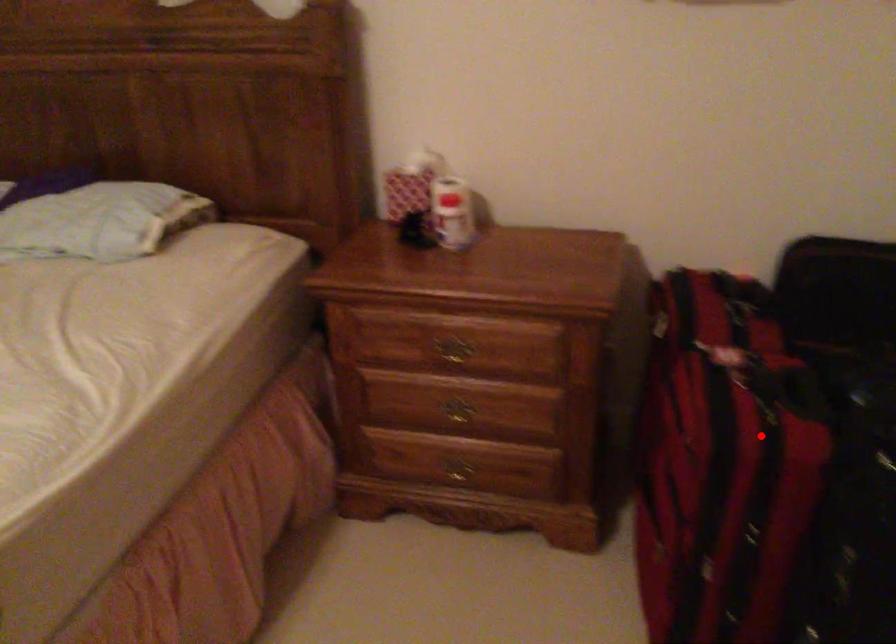
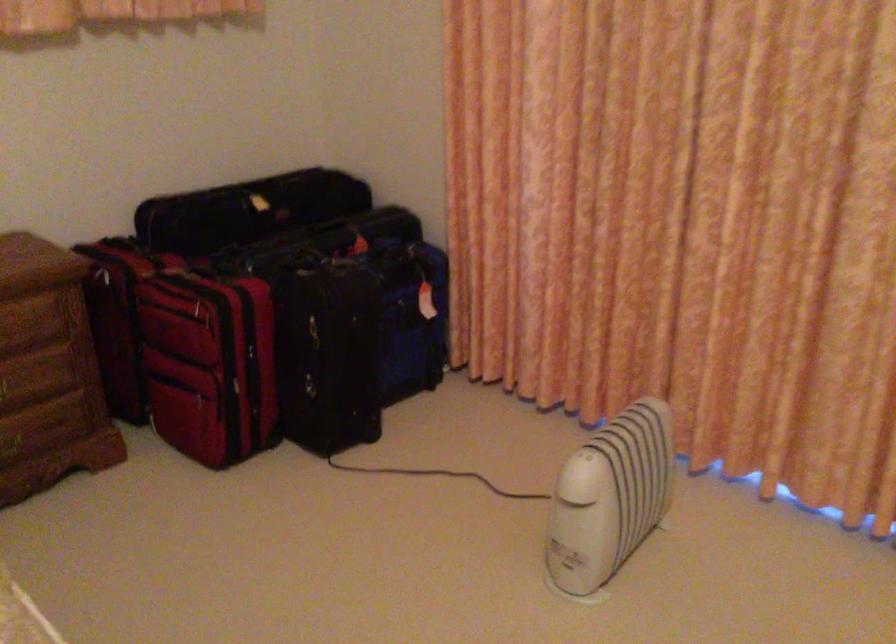
Question: I am providing you with two images of the same scene from different viewpoints. In image1, a red point is highlighted. Considering the same 3D point in image2, which of the following is correct?

Choices:
 (A) It is closer
 (B) It is farther

Answer: (B)